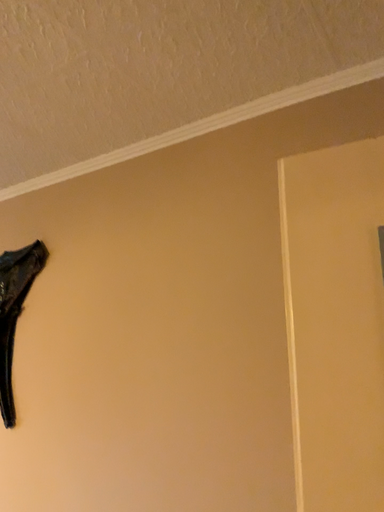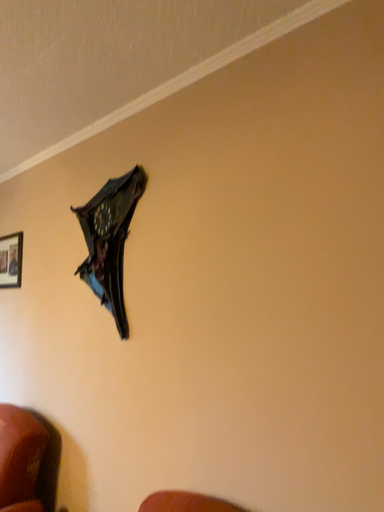
Question: Which way did the camera rotate in the video?

Choices:
 (A) rotated right
 (B) rotated left

Answer: (B)